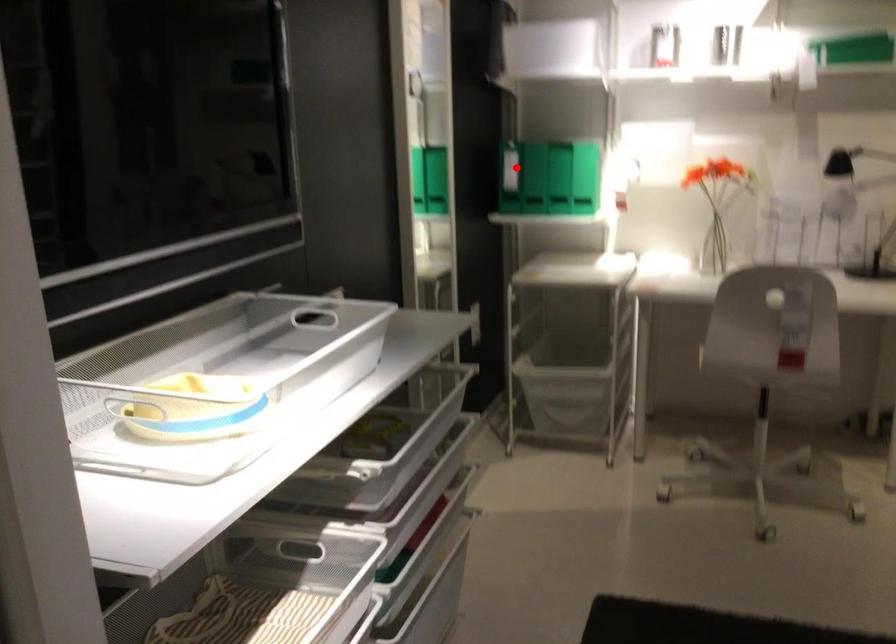
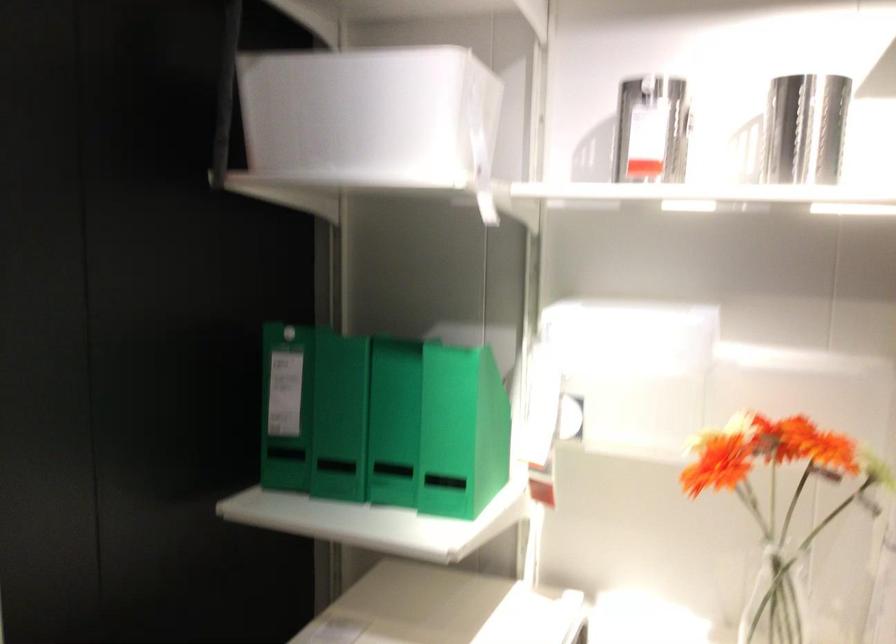
The point at the highlighted location is marked in the first image. Where is the corresponding point in the second image?

(286, 406)